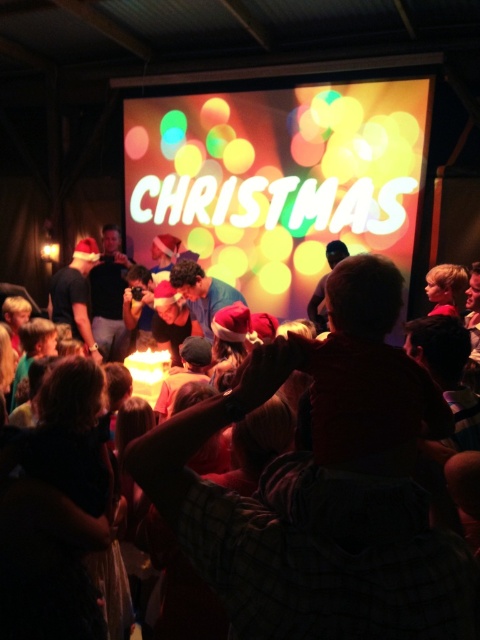
Locate an element on the screen. The image size is (480, 640). neon sign at center is located at coordinates (276, 180).

Does neon sign at center appear under matte black shirt at center?

No.

Which is in front, point (280, 292) or point (63, 308)?

Point (63, 308) is more forward.

Identify the location of neon sign at center. This screenshot has height=640, width=480. 276,180.

Which is above, matte red hat at center or matte black shirt at center?

Positioned higher is matte black shirt at center.

Can you confirm if matte red hat at center is positioned below matte black shirt at center?

Correct, matte red hat at center is located below matte black shirt at center.

Does point (375, 410) come in front of point (60, 275)?

Yes, it is in front of point (60, 275).

I want to click on matte red hat at center, so click(324, 486).

Does matte red hat at center have a smaller size compared to neon sign at center?

Indeed, matte red hat at center has a smaller size compared to neon sign at center.

Can you confirm if matte red hat at center is wider than neon sign at center?

No, matte red hat at center is not wider than neon sign at center.

Does point (323, 355) lie in front of point (155, 120)?

Yes, point (323, 355) is in front of point (155, 120).

Locate an element on the screen. matte red hat at center is located at coordinates (324, 486).